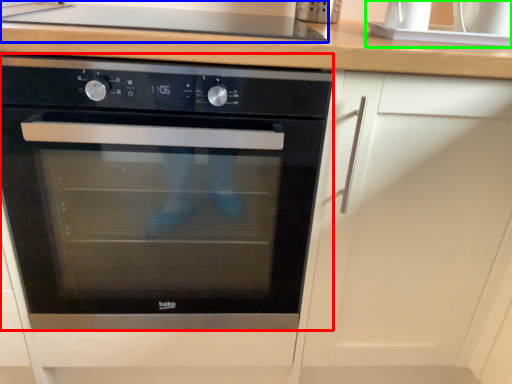
Question: Based on their relative distances, which object is farther from oven (highlighted by a red box)? Choose from gas stove (highlighted by a blue box) and sink (highlighted by a green box).

Choices:
 (A) gas stove
 (B) sink

Answer: (B)